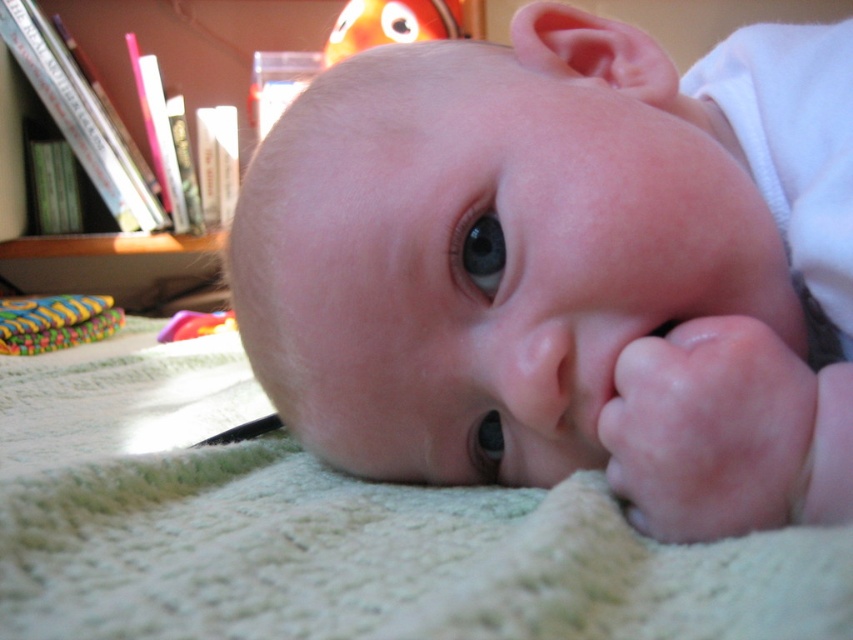
Is smooth skin baby at center positioned before multicolored fabric toy at lower left?

Yes.

Can you confirm if smooth skin baby at center is positioned above multicolored fabric toy at lower left?

Yes.

Image resolution: width=853 pixels, height=640 pixels. I want to click on smooth skin baby at center, so click(566, 268).

Locate an element on the screen. The width and height of the screenshot is (853, 640). smooth skin baby at center is located at coordinates (566, 268).

Who is lower down, smooth skin baby at center or wooden bookshelf at left?

Positioned lower is smooth skin baby at center.

Is smooth skin baby at center to the right of wooden bookshelf at left from the viewer's perspective?

Indeed, smooth skin baby at center is positioned on the right side of wooden bookshelf at left.

Which is behind, point (819, 513) or point (112, 252)?

Point (112, 252)

This screenshot has width=853, height=640. I want to click on smooth skin baby at center, so (x=566, y=268).

Is point (692, 515) positioned behind point (239, 74)?

No, it is not.

Based on the photo, is pink flesh at lower right in front of wooden bookshelf at left?

Yes, pink flesh at lower right is closer to the viewer.

The width and height of the screenshot is (853, 640). In order to click on pink flesh at lower right in this screenshot , I will do `click(711, 429)`.